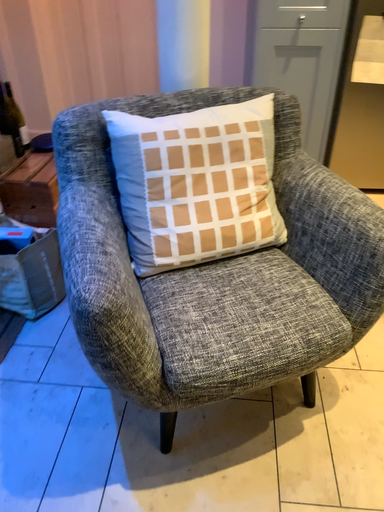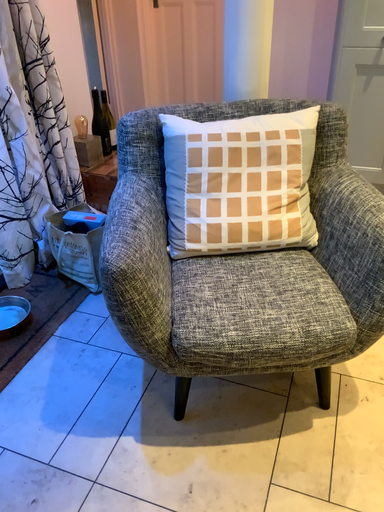
Question: How did the camera likely rotate when shooting the video?

Choices:
 (A) rotated left
 (B) rotated right

Answer: (A)